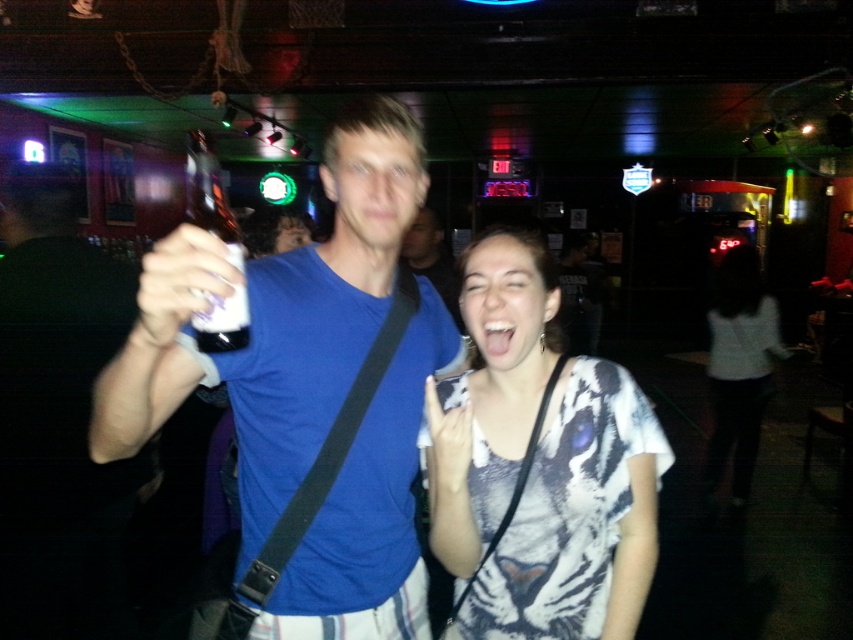
Question: Can you confirm if clear plastic bottle at upper left is smaller than blue cotton shirt at center?

Choices:
 (A) yes
 (B) no

Answer: (B)

Question: Which of the following is the farthest from the observer?

Choices:
 (A) blue cotton shirt at center
 (B) white matte shirt at lower right

Answer: (B)

Question: Does clear plastic bottle at upper left have a greater width compared to blue cotton shirt at center?

Choices:
 (A) no
 (B) yes

Answer: (B)

Question: Which object is positioned closest to the clear plastic bottle at upper left?

Choices:
 (A) white tiger print shirt at center
 (B) white matte shirt at lower right
 (C) blue cotton shirt at center

Answer: (A)

Question: Can you confirm if white matte shirt at lower right is thinner than blue cotton shirt at center?

Choices:
 (A) yes
 (B) no

Answer: (B)

Question: Estimate the real-world distances between objects in this image. Which object is farther from the blue cotton shirt at center?

Choices:
 (A) white tiger print shirt at center
 (B) clear plastic bottle at upper left
 (C) white matte shirt at lower right
 (D) blue matte shirt at center

Answer: (B)